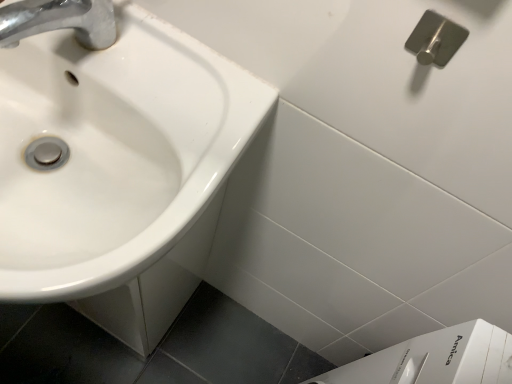
Measure the distance between white glossy sink at left and camera.

They are 15.21 inches apart.

This screenshot has height=384, width=512. What do you see at coordinates (113, 152) in the screenshot?
I see `white glossy sink at left` at bounding box center [113, 152].

This screenshot has width=512, height=384. In order to click on white glossy sink at left in this screenshot , I will do `click(113, 152)`.

In order to click on white glossy sink at left in this screenshot , I will do `click(113, 152)`.